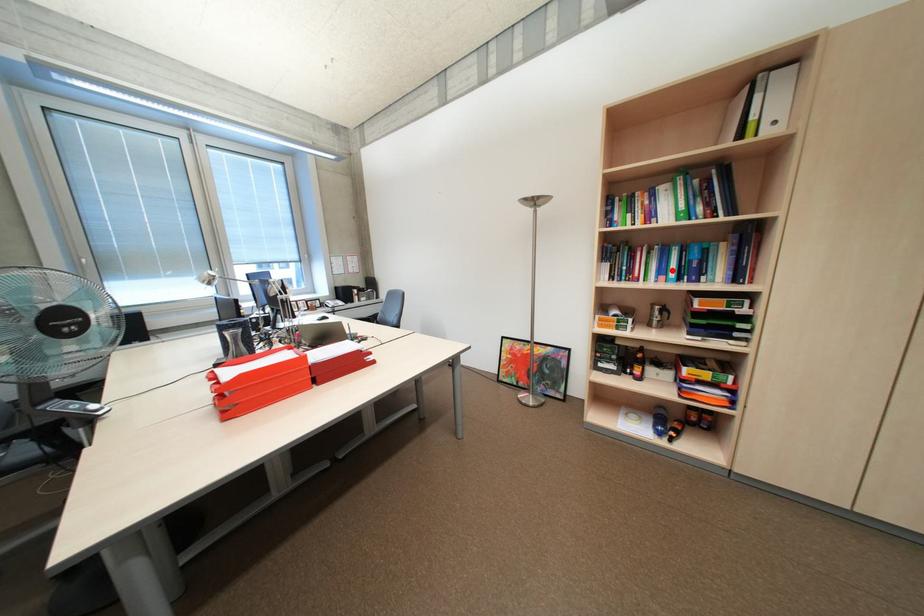
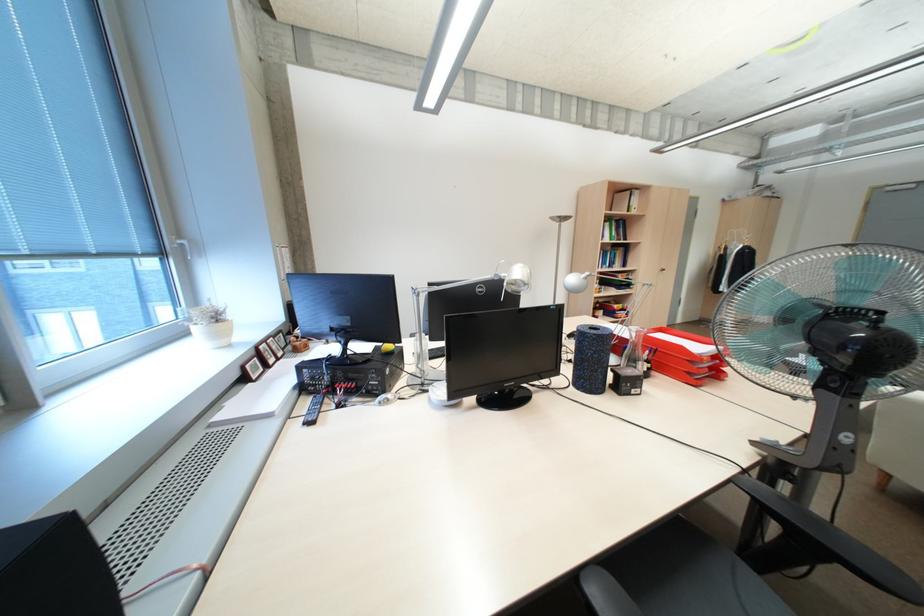
In the second image, find the point that corresponds to the highlighted location in the first image.

(614, 262)